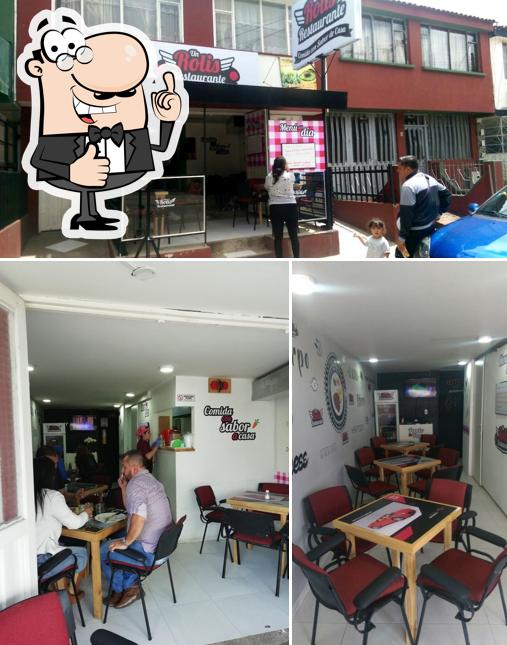
The height and width of the screenshot is (645, 507). In order to click on lights in this screenshot , I will do `click(373, 357)`, `click(167, 369)`, `click(128, 395)`, `click(486, 339)`, `click(29, 368)`.